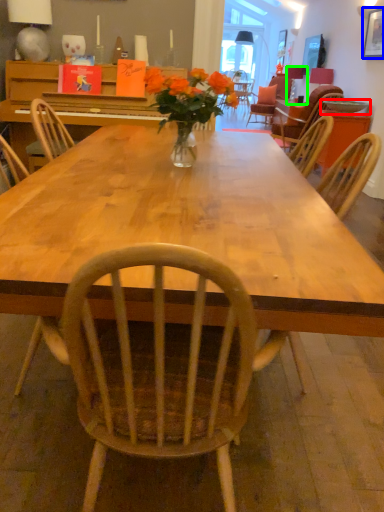
Question: Which object is positioned farthest from bowl (highlighted by a red box)? Select from painting (highlighted by a blue box) and lamp (highlighted by a green box).

Choices:
 (A) painting
 (B) lamp

Answer: (B)